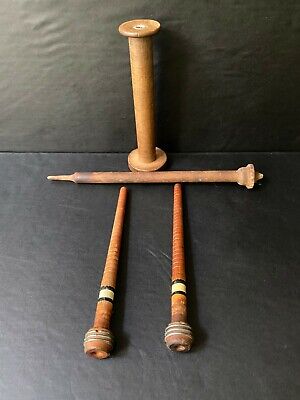
The height and width of the screenshot is (400, 300). Find the location of `wood carvings`. wood carvings is located at coordinates (177, 223).